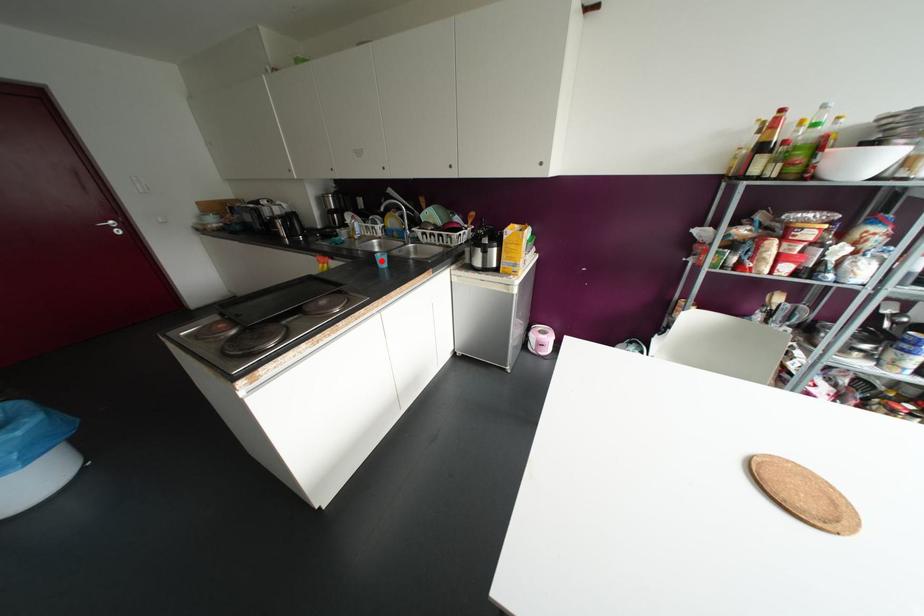
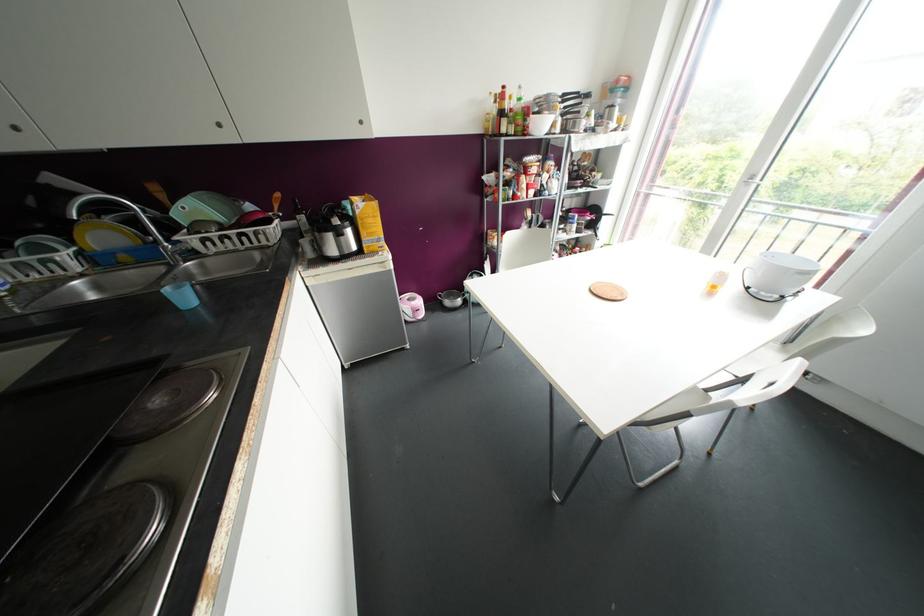
The point at the highlighted location is marked in the first image. Where is the corresponding point in the second image?

(184, 297)